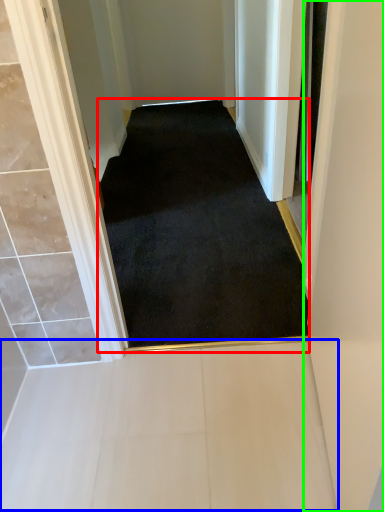
Question: Which object is the farthest from doormat (highlighted by a red box)? Choose among these: path (highlighted by a blue box) or door (highlighted by a green box).

Choices:
 (A) path
 (B) door

Answer: (B)